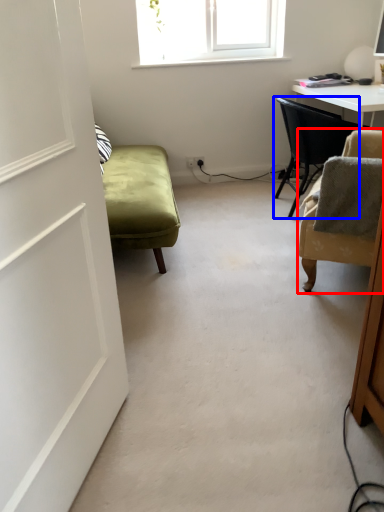
Question: Which of the following is the closest to the observer, chair (highlighted by a red box) or chair (highlighted by a blue box)?

Choices:
 (A) chair
 (B) chair

Answer: (A)